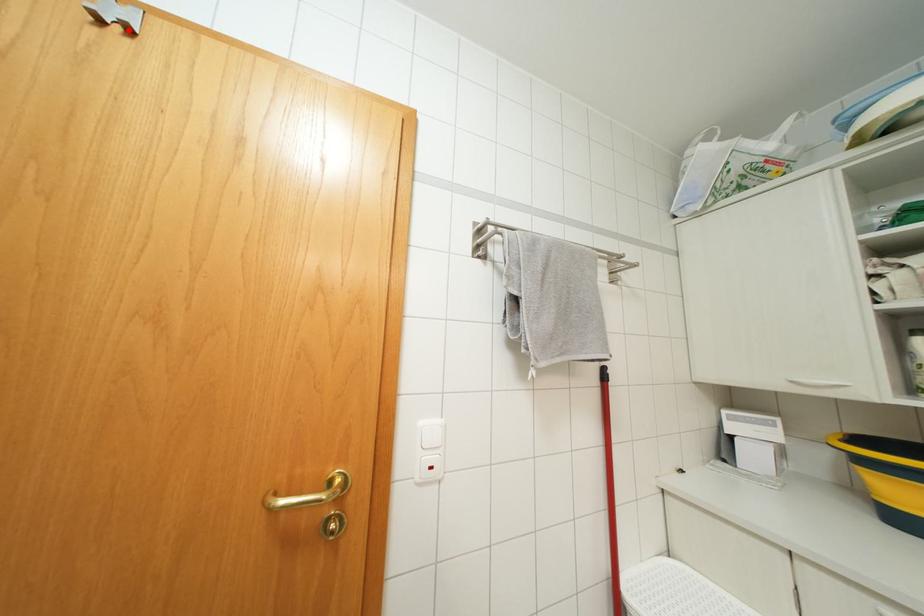
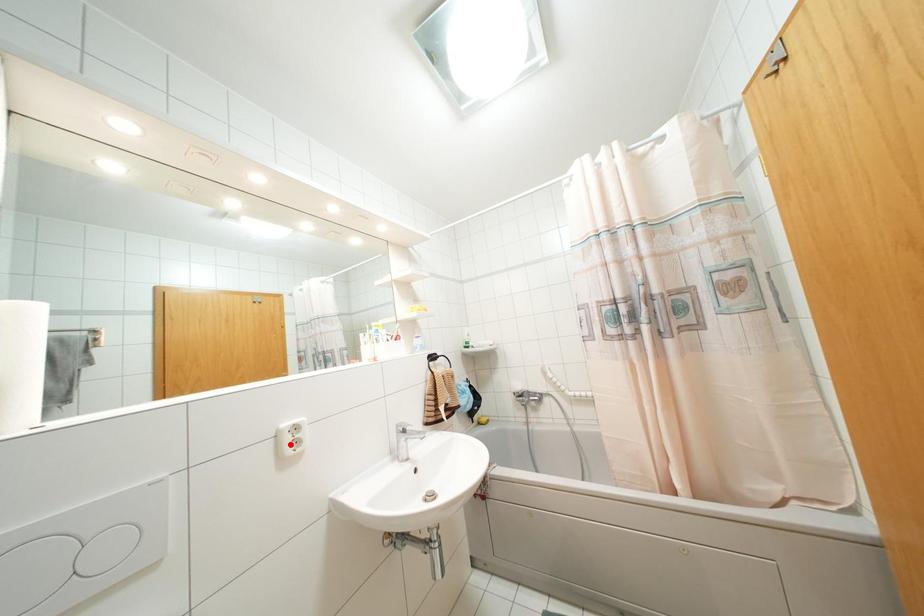
I am providing you with two images of the same scene from different viewpoints. A red point is marked on the first image and another point is marked on the second image. Is the marked point in image1 the same physical position as the marked point in image2?

No